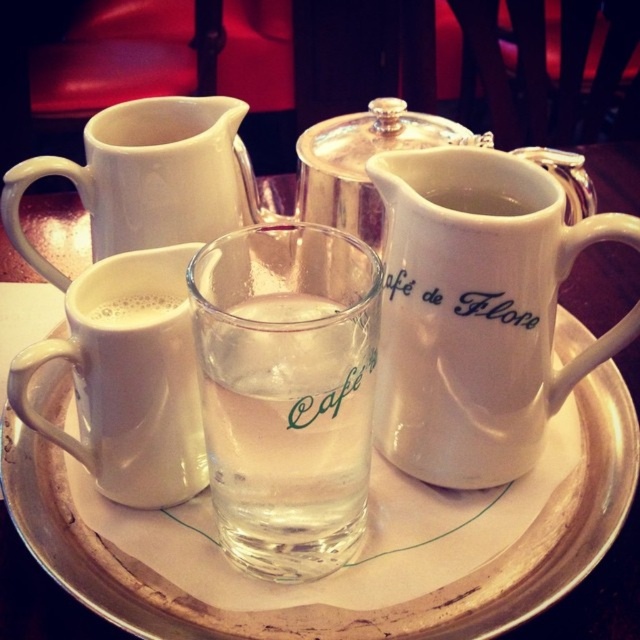
In the scene shown: You are a barista arranging items on a tray. You need to pour coffee from the white ceramic pitcher at right into the white frothy coffee at upper left. Can you do this without moving the tray?

The white ceramic pitcher at right is closer to the viewer than the white frothy coffee at upper left, so you can pour the coffee from the pitcher into the frothy coffee without needing to move the tray.

From the picture: You are a barista at the cafe, and you need to pour water from the clear glass water at center into the white ceramic pitcher at right. Can you do this without moving the pitcher?

The clear glass water at center is behind the white ceramic pitcher at right, so you cannot pour water from the clear glass water at center into the white ceramic pitcher at right without moving the pitcher.